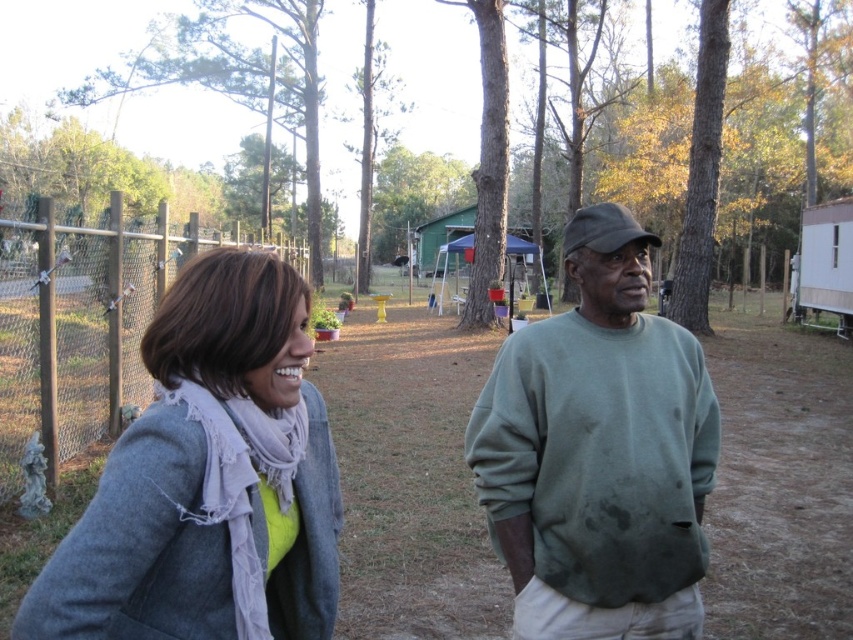
Question: Based on their relative distances, which object is farther from the green matte sweatshirt at center?

Choices:
 (A) gray woolen coat at left
 (B) gray sweater at center

Answer: (A)

Question: From the image, what is the correct spatial relationship of gray sweater at center in relation to gray woolen coat at left?

Choices:
 (A) above
 (B) below

Answer: (A)

Question: Is gray sweater at center to the left of green matte sweatshirt at center from the viewer's perspective?

Choices:
 (A) no
 (B) yes

Answer: (A)

Question: Considering the relative positions of gray woolen coat at left and green matte sweatshirt at center in the image provided, where is gray woolen coat at left located with respect to green matte sweatshirt at center?

Choices:
 (A) above
 (B) below

Answer: (B)

Question: Which of these objects is positioned farthest from the gray sweater at center?

Choices:
 (A) green matte sweatshirt at center
 (B) gray woolen coat at left

Answer: (B)

Question: Which of these objects is positioned closest to the green matte sweatshirt at center?

Choices:
 (A) gray sweater at center
 (B) gray woolen coat at left

Answer: (A)